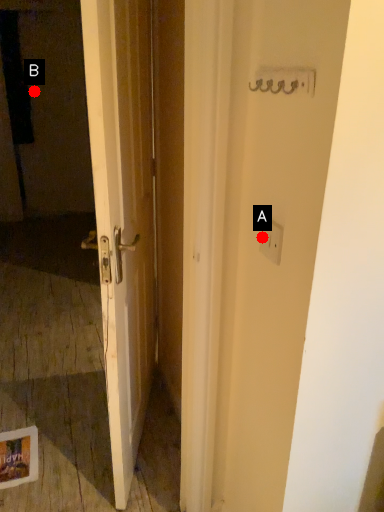
Question: Two points are circled on the image, labeled by A and B beside each circle. Which point is closer to the camera?

Choices:
 (A) A is closer
 (B) B is closer

Answer: (A)